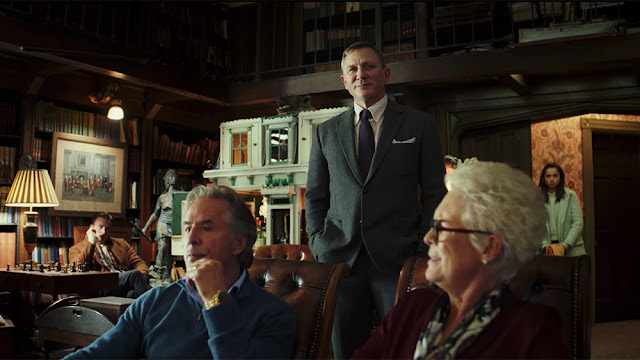
Where is `statue`? statue is located at coordinates (166, 208), (163, 238), (157, 261), (173, 174).